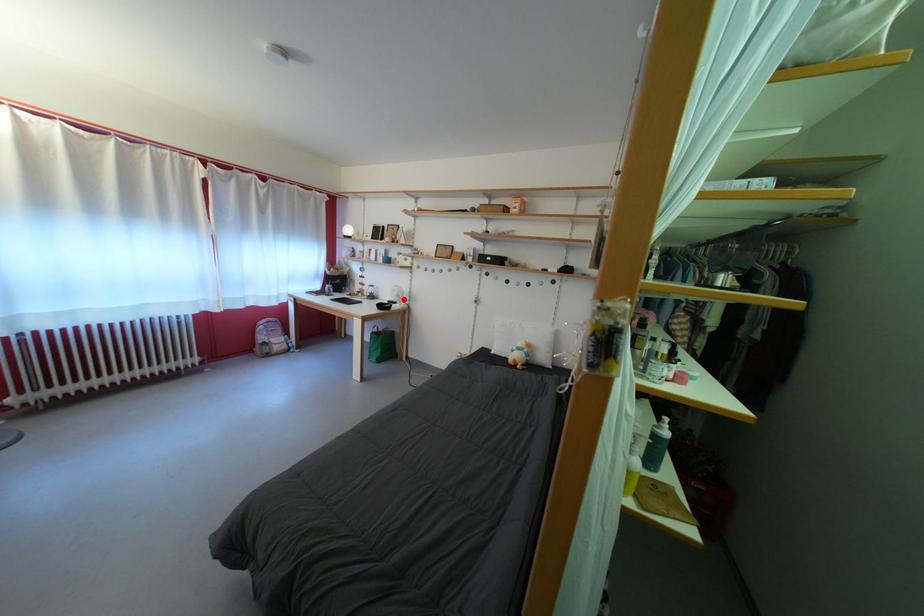
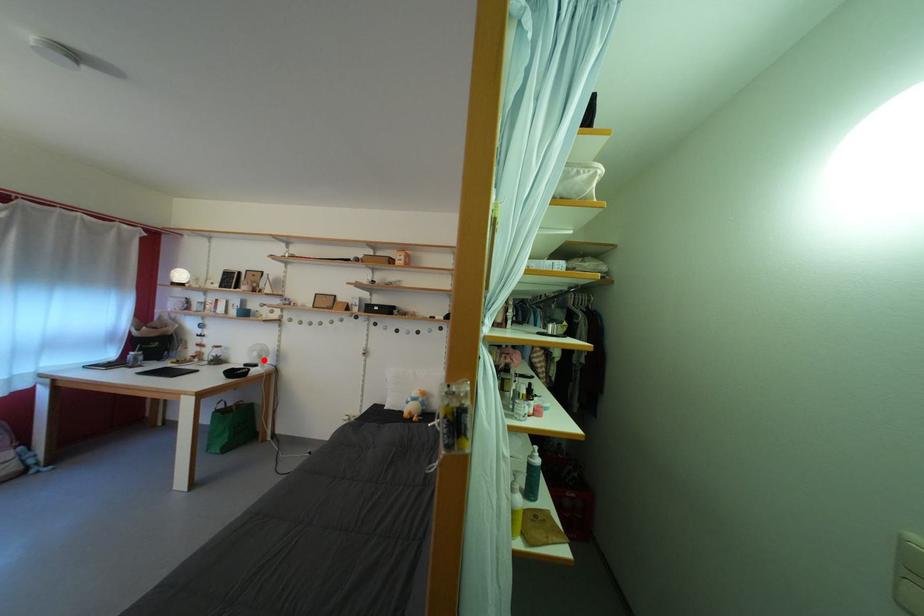
I am providing you with two images of the same scene from different viewpoints. A red point is marked on the first image and another point is marked on the second image. Is the red point in image1 aligned with the point shown in image2?

Yes